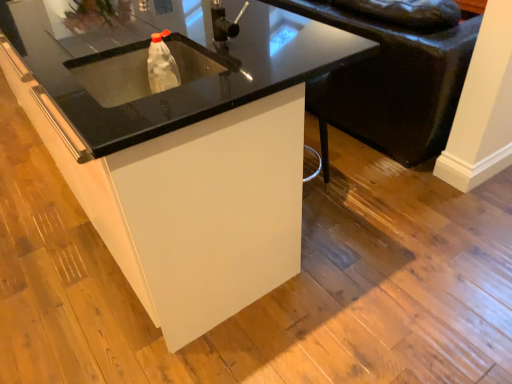
What do you see at coordinates (181, 147) in the screenshot? I see `white glossy table at center` at bounding box center [181, 147].

What is the approximate width of white glossy table at center?

white glossy table at center is 37.71 inches in width.

This screenshot has height=384, width=512. In order to click on white glossy table at center in this screenshot , I will do `click(181, 147)`.

Locate an element on the screen. This screenshot has width=512, height=384. white glossy table at center is located at coordinates (181, 147).